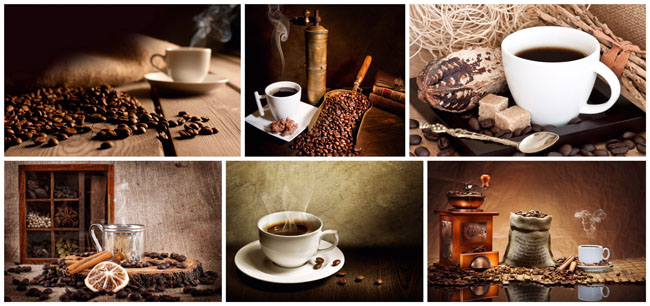
Identify the location of picture. The width and height of the screenshot is (650, 306). click(493, 234), click(305, 252), click(325, 80), click(511, 70), click(177, 104), click(148, 232).